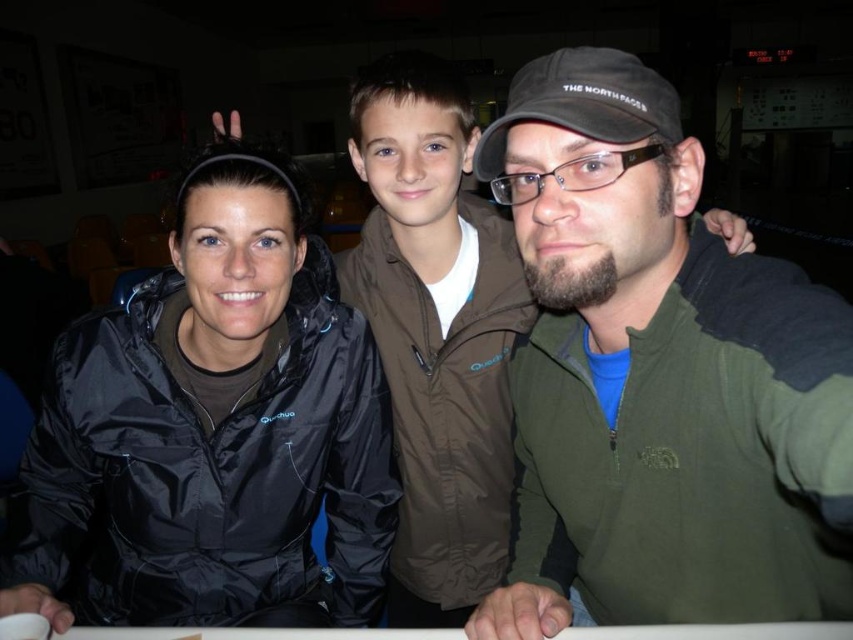
You are a photographer trying to adjust the lighting for a portrait. You notice the black matte jacket at center and the black fabric baseball cap at center in your frame. Which object should you focus on first if you want to ensure proper exposure, considering their positions?

The black fabric baseball cap at center is above the black matte jacket at center, so you should focus on the black fabric baseball cap at center first to ensure proper exposure.

Looking at this image, you are a photographer at an event and want to ensure the green fleece jacket at center and the black fabric baseball cap at center are both visible in your photo. Based on their positions, which one is located to the right of the other?

The green fleece jacket at center is positioned on the right side of the black fabric baseball cap at center, so the green fleece jacket at center is to the right of the black fabric baseball cap at center.

You are standing at the point labeled as point (548, 115) and want to move to the point labeled as point (782, 426). Can you walk directly towards it without any obstacles in between?

Yes, you can walk directly towards point (782, 426) from point (548, 115) because the description states that point (782, 426) is in front of point (548, 115), implying there are no obstacles blocking the path between them.